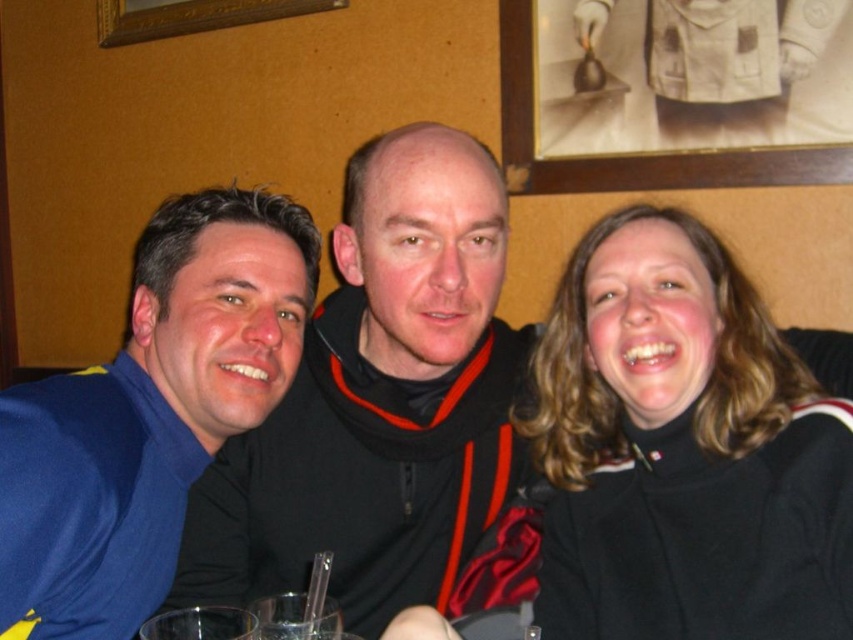
Can you confirm if black turtleneck sweater at right is positioned below black matte jacket at center?

Correct, black turtleneck sweater at right is located below black matte jacket at center.

Which is more to the right, black turtleneck sweater at right or black matte jacket at center?

black turtleneck sweater at right is more to the right.

Between point (720, 451) and point (207, 570), which one is positioned in front?

Point (720, 451)

Locate an element on the screen. This screenshot has height=640, width=853. black turtleneck sweater at right is located at coordinates (682, 451).

Does point (639, 346) come in front of point (0, 611)?

No.

Where is `black turtleneck sweater at right`? black turtleneck sweater at right is located at coordinates (682, 451).

Can you confirm if black matte jacket at center is positioned above blue fabric shirt at left?

Yes, black matte jacket at center is above blue fabric shirt at left.

Between black matte jacket at center and blue fabric shirt at left, which one has more height?

black matte jacket at center

Does point (360, 561) come closer to viewer compared to point (148, 244)?

That is False.

You are a GUI agent. You are given a task and a screenshot of the screen. Output one action in this format:
    pyautogui.click(x=<x>, y=<y>)
    Task: Click on the black matte jacket at center
    Image resolution: width=853 pixels, height=640 pixels.
    Given the screenshot: What is the action you would take?
    pyautogui.click(x=379, y=403)